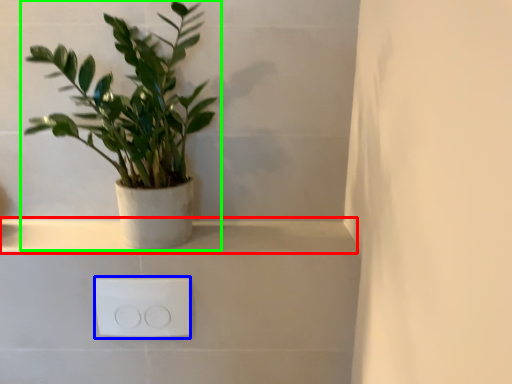
Question: Estimate the real-world distances between objects in this image. Which object is farther from window sill (highlighted by a red box), electric outlet (highlighted by a blue box) or houseplant (highlighted by a green box)?

Choices:
 (A) electric outlet
 (B) houseplant

Answer: (B)